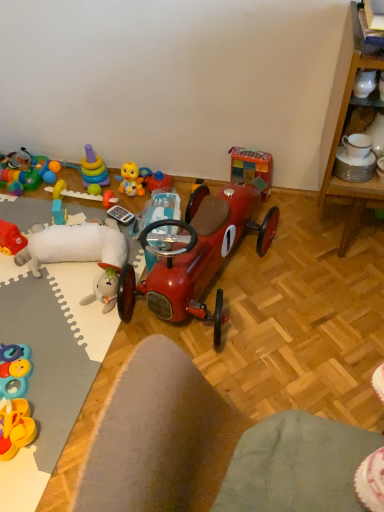
At what (x,y) coordinates should I click in order to perform the action: click on vacant space to the right of rubber duck at lower left, which is counted as the 7th toy, starting from the right. Please return your answer as a coordinate pair (x, y). This screenshot has width=384, height=512. Looking at the image, I should click on (64, 422).